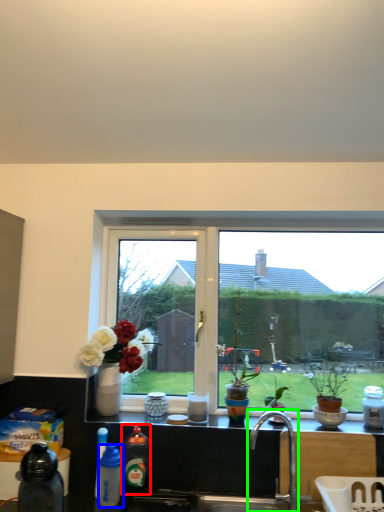
Question: Which is nearer to the bottle (highlighted by a red box)? bottle (highlighted by a blue box) or tap (highlighted by a green box).

Choices:
 (A) bottle
 (B) tap

Answer: (A)